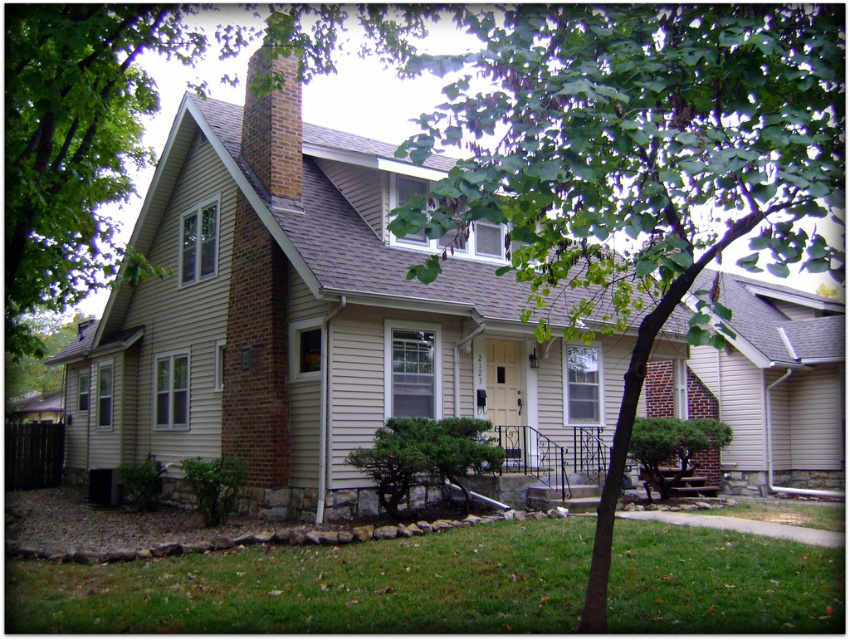
Looking at this image, is green leafy tree at center above green grass at lower left?

Correct, green leafy tree at center is located above green grass at lower left.

Who is positioned more to the left, green leafy tree at center or green grass at lower left?

green grass at lower left

This screenshot has height=640, width=850. In order to click on green leafy tree at center in this screenshot , I will do `click(636, 163)`.